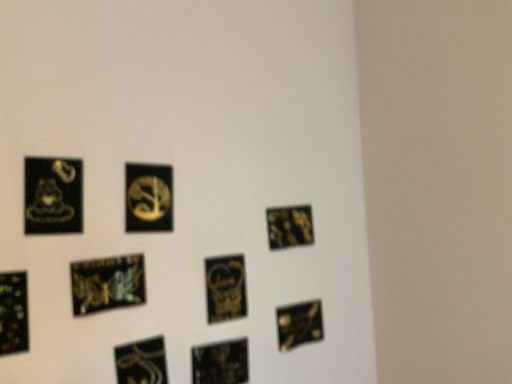
Question: Should I look upward or downward to see metallic gold picture frame at lower center, the 4th picture frame from the right?

Choices:
 (A) up
 (B) down

Answer: (B)

Question: Are black glossy square at bottom right, the 1th picture frame when ordered from right to left, and metallic gold picture frame at lower left, the 9th picture frame viewed from the right, far apart?

Choices:
 (A) no
 (B) yes

Answer: (A)

Question: Considering the relative positions of black glossy square at bottom right, the 1th picture frame when ordered from right to left, and metallic gold picture frame at lower left, the first picture frame viewed from the left, in the image provided, is black glossy square at bottom right, the 1th picture frame when ordered from right to left, to the left of metallic gold picture frame at lower left, the first picture frame viewed from the left, from the viewer's perspective?

Choices:
 (A) yes
 (B) no

Answer: (B)

Question: From a real-world perspective, is black glossy square at bottom right, arranged as the ninth picture frame when viewed from the left, beneath metallic gold picture frame at lower left, the 9th picture frame viewed from the right?

Choices:
 (A) no
 (B) yes

Answer: (B)

Question: Is the depth of black glossy square at bottom right, arranged as the ninth picture frame when viewed from the left, greater than that of metallic gold picture frame at lower left, the 9th picture frame viewed from the right?

Choices:
 (A) yes
 (B) no

Answer: (A)

Question: Can you confirm if black glossy square at bottom right, arranged as the ninth picture frame when viewed from the left, is wider than metallic gold picture frame at lower left, the first picture frame viewed from the left?

Choices:
 (A) no
 (B) yes

Answer: (B)

Question: Considering the relative sizes of black glossy square at bottom right, the 1th picture frame when ordered from right to left, and metallic gold picture frame at lower left, the 9th picture frame viewed from the right, in the image provided, is black glossy square at bottom right, the 1th picture frame when ordered from right to left, thinner than metallic gold picture frame at lower left, the 9th picture frame viewed from the right,?

Choices:
 (A) no
 (B) yes

Answer: (A)

Question: Is glossy black picture frame at lower left, the third picture frame positioned from the left, positioned in front of black glossy sticker at lower left, which is the 4th picture frame from left to right?

Choices:
 (A) no
 (B) yes

Answer: (B)

Question: Can we say glossy black picture frame at lower left, the 7th picture frame positioned from the right, lies outside black glossy sticker at lower left, positioned as the sixth picture frame in right-to-left order?

Choices:
 (A) no
 (B) yes

Answer: (B)

Question: Can you confirm if glossy black picture frame at lower left, the third picture frame positioned from the left, is positioned to the left of black glossy sticker at lower left, positioned as the sixth picture frame in right-to-left order?

Choices:
 (A) yes
 (B) no

Answer: (A)

Question: From the image's perspective, does glossy black picture frame at lower left, the 7th picture frame positioned from the right, appear higher than black glossy sticker at lower left, positioned as the sixth picture frame in right-to-left order?

Choices:
 (A) no
 (B) yes

Answer: (B)

Question: Considering the relative sizes of glossy black picture frame at lower left, the 7th picture frame positioned from the right, and black glossy sticker at lower left, which is the 4th picture frame from left to right, in the image provided, is glossy black picture frame at lower left, the 7th picture frame positioned from the right, bigger than black glossy sticker at lower left, which is the 4th picture frame from left to right,?

Choices:
 (A) yes
 (B) no

Answer: (A)

Question: Considering the relative sizes of glossy black picture frame at lower left, the third picture frame positioned from the left, and black glossy sticker at lower left, which is the 4th picture frame from left to right, in the image provided, is glossy black picture frame at lower left, the third picture frame positioned from the left, thinner than black glossy sticker at lower left, which is the 4th picture frame from left to right,?

Choices:
 (A) no
 (B) yes

Answer: (A)

Question: Is glossy black picture frame at lower left, the third picture frame positioned from the left, taller than metallic gold picture frame at lower left, the first picture frame viewed from the left?

Choices:
 (A) yes
 (B) no

Answer: (B)